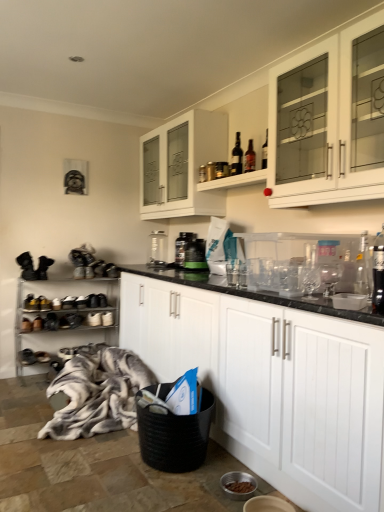
Question: From a real-world perspective, relative to metallic silver shoe rack at left, the second shelf from the right, is matte glass bottles at upper center, positioned as the first shelf in right-to-left order, vertically above or below?

Choices:
 (A) below
 (B) above

Answer: (B)

Question: Looking at the image, does matte glass bottles at upper center, marked as the 1th shelf in a front-to-back arrangement, seem bigger or smaller compared to metallic silver shoe rack at left, which is the first shelf from bottom to top?

Choices:
 (A) small
 (B) big

Answer: (A)

Question: Estimate the real-world distances between objects in this image. Which object is farther from the white glass cabinet at upper center, acting as the third cabinetry starting from the bottom?

Choices:
 (A) metallic silver shoe rack at left, the second shelf from the right
 (B) white matte cabinet at center, acting as the first cabinetry starting from the bottom
 (C) black plastic bottle at center
 (D) black plastic container at center
 (E) black woven laundry basket at lower center

Answer: (E)

Question: Estimate the real-world distances between objects in this image. Which object is closer to the black woven laundry basket at lower center?

Choices:
 (A) black suede shoe at lower left
 (B) white matte cabinet at center, acting as the first cabinetry starting from the bottom
 (C) dark glass bottle at upper center, the 2th bottle positioned from the right
 (D) black plastic bottle at center
 (E) clear glass bottle at upper right, which ranks as the second bottle in top-to-bottom order

Answer: (B)